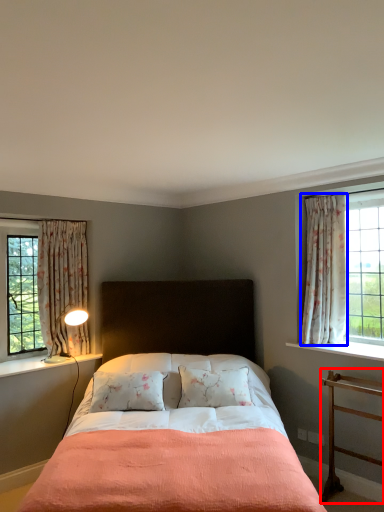
Question: Which point is closer to the camera, nightstand (highlighted by a red box) or curtain (highlighted by a blue box)?

Choices:
 (A) nightstand
 (B) curtain

Answer: (A)